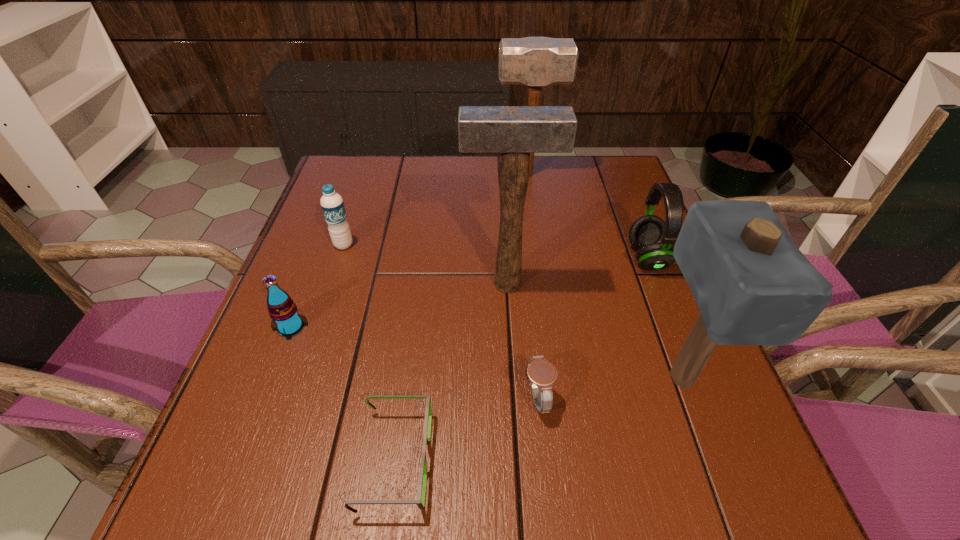
The image size is (960, 540). In order to click on blank space located 0.190m on the lens of the spectacles in this screenshot , I will do `click(552, 460)`.

Locate an element on the screen. Image resolution: width=960 pixels, height=540 pixels. object located in the far edge section of the desktop is located at coordinates (532, 61).

Where is `object that is at the near edge`? The height and width of the screenshot is (540, 960). object that is at the near edge is located at coordinates (420, 502).

Locate an element on the screen. The height and width of the screenshot is (540, 960). water bottle that is at the left edge is located at coordinates (332, 204).

The width and height of the screenshot is (960, 540). What are the coordinates of `soda that is at the left edge` in the screenshot? It's located at (283, 311).

The height and width of the screenshot is (540, 960). I want to click on mallet located in the right edge section of the desktop, so (753, 286).

Where is `headset at the right edge`? The height and width of the screenshot is (540, 960). headset at the right edge is located at coordinates point(654,239).

Locate an element on the screen. free space at the far edge of the desktop is located at coordinates (418, 184).

In the image, there is a desktop. Where is `vacant space at the near edge`? Image resolution: width=960 pixels, height=540 pixels. vacant space at the near edge is located at coordinates (342, 469).

Identify the location of free region at the left edge of the desktop. The height and width of the screenshot is (540, 960). (315, 216).